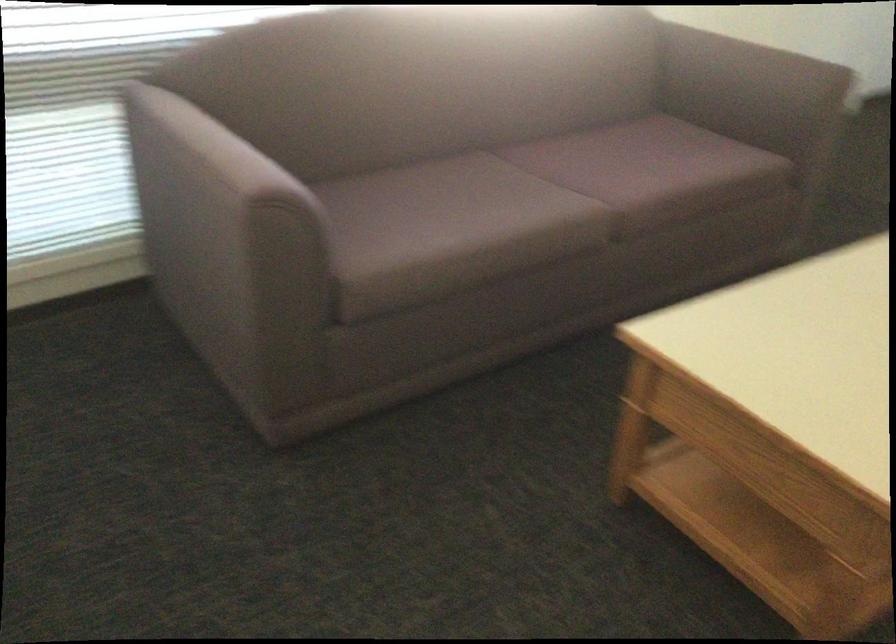
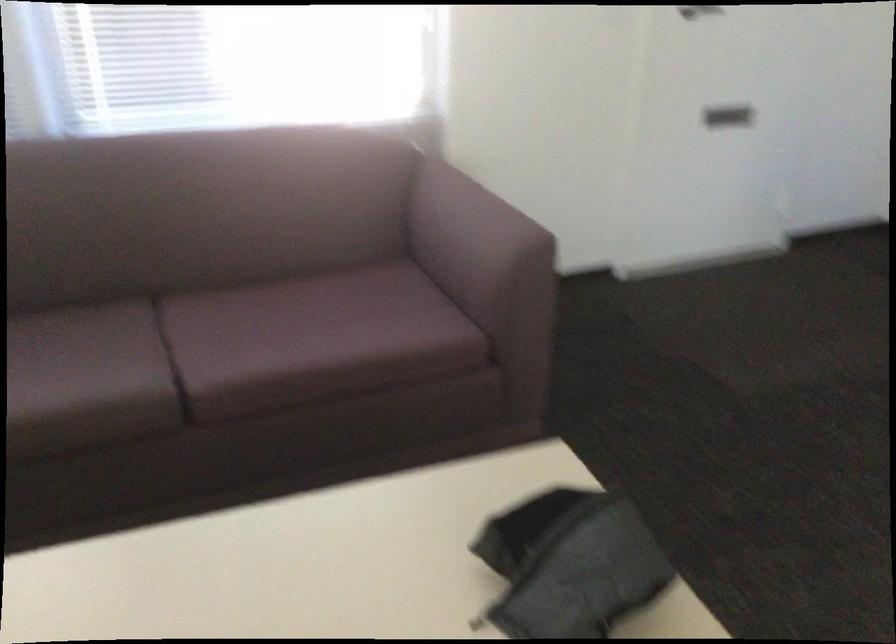
Question: The images are taken continuously from a first-person perspective. In which direction are you moving?

Choices:
 (A) Left
 (B) Right
 (C) Forward
 (D) Backward

Answer: (B)